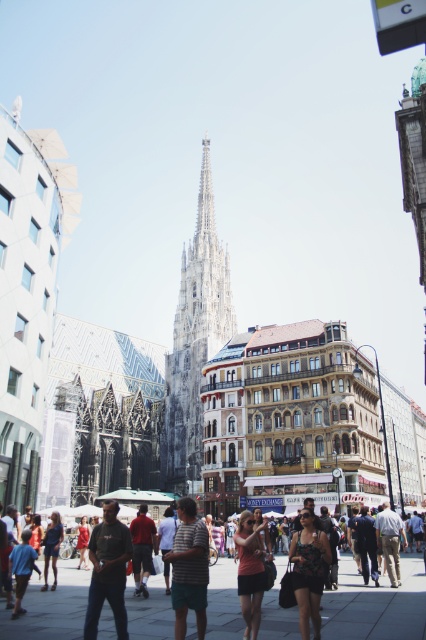
You are a photographer standing at the edge of the street. You notice a matte black dress at lower center and dark blue jeans at center. Which clothing item appears bigger in the photo?

The matte black dress at lower center appears bigger than the dark blue jeans at center in the photo.

You are a photographer standing on the street and want to take a photo that includes both the matte pink shirt at center and the blue shirt at lower left. Which person should you focus on first to ensure both are in frame?

The matte pink shirt at center is much taller than the blue shirt at lower left, so you should focus on the matte pink shirt at center first to ensure both are in frame.

You are a photographer standing on the street in front of the cathedral. You see a person wearing a matte black dress at lower center and another wearing dark blue jeans at center. Which clothing item is more to the right?

The matte black dress at lower center is more to the right because it is positioned on the right side of the dark blue jeans at center.